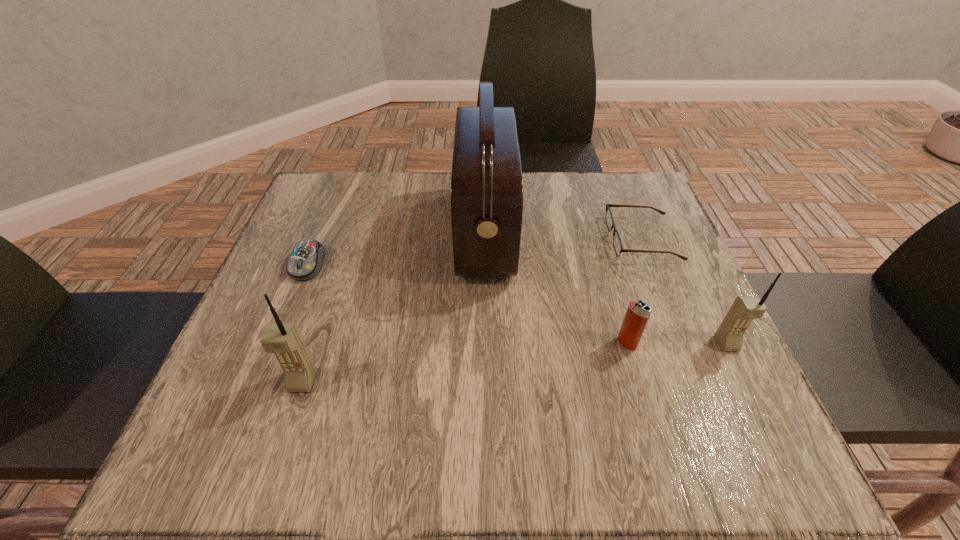
Identify the location of blank area located 0.050m on the front of the right cellular telephone, where the keypad is located. [743, 376].

Identify the location of vacant space situated 0.170m on the front panel of the fourth object from right to left. (385, 232).

Find the location of a particular element. Image resolution: width=960 pixels, height=540 pixels. blank space located on the front panel of the fourth object from right to left is located at coordinates (427, 232).

What are the coordinates of `vacant region located on the front panel of the fourth object from right to left` in the screenshot? It's located at (305, 232).

This screenshot has width=960, height=540. What are the coordinates of `vacant space located 0.340m on the front-facing side of the spectacles` in the screenshot? It's located at (465, 238).

You are a GUI agent. You are given a task and a screenshot of the screen. Output one action in this format:
    pyautogui.click(x=<x>, y=<y>)
    Task: Click on the vacant space situated 0.270m on the front-facing side of the spectacles
    This screenshot has height=540, width=960.
    Given the screenshot: What is the action you would take?
    pyautogui.click(x=494, y=238)

You are a GUI agent. You are given a task and a screenshot of the screen. Output one action in this format:
    pyautogui.click(x=<x>, y=<y>)
    Task: Click on the free spot located on the front-facing side of the spectacles
    The height and width of the screenshot is (540, 960).
    Given the screenshot: What is the action you would take?
    pyautogui.click(x=465, y=238)

Identify the location of free spot located 0.240m on the wheel side of the computer mouse. This screenshot has width=960, height=540. (260, 382).

Where is `vacant area situated 0.300m on the back of the third object from right to left`? The image size is (960, 540). vacant area situated 0.300m on the back of the third object from right to left is located at coordinates (595, 234).

This screenshot has width=960, height=540. I want to click on radio receiver situated at the far edge, so click(x=486, y=180).